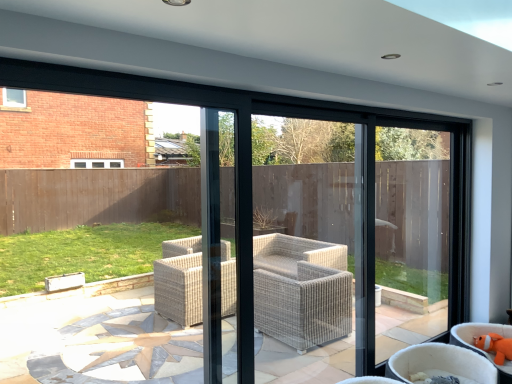
This screenshot has width=512, height=384. What are the coordinates of `beige wicker chair at lower right, which ranks as the second chair in right-to-left order` in the screenshot? It's located at (441, 363).

The image size is (512, 384). I want to click on orange plush toy at lower right, so click(495, 346).

Find the location of `beige wicker chair at lower right, which ranks as the second chair in right-to-left order`. beige wicker chair at lower right, which ranks as the second chair in right-to-left order is located at coordinates (441, 363).

Can you confirm if orange plush toy at lower right, positioned as the 1th chair in right-to-left order, is positioned to the left of beige wicker chair at lower right, which is counted as the 1th chair, starting from the left?

No.

From the image's perspective, is orange plush toy at lower right, positioned as the 1th chair in right-to-left order, under beige wicker chair at lower right, which is counted as the 1th chair, starting from the left?

Actually, orange plush toy at lower right, positioned as the 1th chair in right-to-left order, appears above beige wicker chair at lower right, which is counted as the 1th chair, starting from the left, in the image.

From a real-world perspective, which is physically above, orange plush toy at lower right, positioned as the 1th chair in right-to-left order, or beige wicker chair at lower right, which ranks as the second chair in right-to-left order?

orange plush toy at lower right, positioned as the 1th chair in right-to-left order, from a real-world perspective.

Find the location of a particular element. This screenshot has width=512, height=384. chair on the left of orange plush toy at lower right, positioned as the 1th chair in right-to-left order is located at coordinates (441, 363).

Are beige wicker chair at lower right, which is counted as the 1th chair, starting from the left, and orange plush toy at lower right making contact?

No.

Which of these two, beige wicker chair at lower right, which ranks as the second chair in right-to-left order, or orange plush toy at lower right, stands shorter?

orange plush toy at lower right.

Is beige wicker chair at lower right, which is counted as the 1th chair, starting from the left, spatially inside orange plush toy at lower right, or outside of it?

beige wicker chair at lower right, which is counted as the 1th chair, starting from the left, cannot be found inside orange plush toy at lower right.

Which point is more distant from viewer, (487, 361) or (479, 342)?

The point (479, 342) is behind.

Consider the image. Do you think orange plush toy at lower right, positioned as the 1th chair in right-to-left order, is within orange plush toy at lower right, or outside of it?

orange plush toy at lower right, positioned as the 1th chair in right-to-left order, cannot be found inside orange plush toy at lower right.

Are orange plush toy at lower right, positioned as the 1th chair in right-to-left order, and orange plush toy at lower right making contact?

Indeed, orange plush toy at lower right, positioned as the 1th chair in right-to-left order, and orange plush toy at lower right are beside each other and touching.

Between orange plush toy at lower right, which is the 2th chair from left to right, and orange plush toy at lower right, which one appears on the right side from the viewer's perspective?

orange plush toy at lower right is more to the right.

Which of these two, orange plush toy at lower right or orange plush toy at lower right, which is the 2th chair from left to right, is wider?

orange plush toy at lower right, which is the 2th chair from left to right.

Where is `toy behind the orange plush toy at lower right, which is the 2th chair from left to right`? toy behind the orange plush toy at lower right, which is the 2th chair from left to right is located at coordinates (495, 346).

Is orange plush toy at lower right at the left side of orange plush toy at lower right, positioned as the 1th chair in right-to-left order?

No, orange plush toy at lower right is not to the left of orange plush toy at lower right, positioned as the 1th chair in right-to-left order.

Considering the points (501, 353) and (501, 335), which point is behind, point (501, 353) or point (501, 335)?

Point (501, 335)

Does beige wicker chair at lower right, which ranks as the second chair in right-to-left order, lie in front of orange plush toy at lower right, positioned as the 1th chair in right-to-left order?

Yes, beige wicker chair at lower right, which ranks as the second chair in right-to-left order, is closer to the viewer.

Does beige wicker chair at lower right, which is counted as the 1th chair, starting from the left, have a larger size compared to orange plush toy at lower right, positioned as the 1th chair in right-to-left order?

Correct, beige wicker chair at lower right, which is counted as the 1th chair, starting from the left, is larger in size than orange plush toy at lower right, positioned as the 1th chair in right-to-left order.

Locate an element on the screen. The height and width of the screenshot is (384, 512). chair on the right of the beige wicker chair at lower right, which is counted as the 1th chair, starting from the left is located at coordinates (477, 335).

Does point (406, 354) appear closer or farther from the camera than point (469, 327)?

Clearly, point (406, 354) is closer to the camera than point (469, 327).

Which is behind, orange plush toy at lower right or beige wicker chair at lower right, which ranks as the second chair in right-to-left order?

orange plush toy at lower right is more distant.

The width and height of the screenshot is (512, 384). In order to click on toy above the beige wicker chair at lower right, which is counted as the 1th chair, starting from the left (from a real-world perspective) in this screenshot , I will do `click(495, 346)`.

From a real-world perspective, which is physically below, orange plush toy at lower right or beige wicker chair at lower right, which is counted as the 1th chair, starting from the left?

beige wicker chair at lower right, which is counted as the 1th chair, starting from the left, from a real-world perspective.

Who is bigger, orange plush toy at lower right or beige wicker chair at lower right, which ranks as the second chair in right-to-left order?

beige wicker chair at lower right, which ranks as the second chair in right-to-left order, is bigger.

At what (x,y) coordinates should I click in order to perform the action: click on chair behind the beige wicker chair at lower right, which is counted as the 1th chair, starting from the left. Please return your answer as a coordinate pair (x, y). The image size is (512, 384). Looking at the image, I should click on (477, 335).

You are a GUI agent. You are given a task and a screenshot of the screen. Output one action in this format:
    pyautogui.click(x=<x>, y=<y>)
    Task: Click on the toy above the beige wicker chair at lower right, which is counted as the 1th chair, starting from the left (from a real-world perspective)
    
    Given the screenshot: What is the action you would take?
    pyautogui.click(x=495, y=346)

Considering their positions, is beige wicker chair at lower right, which is counted as the 1th chair, starting from the left, positioned further to orange plush toy at lower right than orange plush toy at lower right, which is the 2th chair from left to right?

Based on the image, beige wicker chair at lower right, which is counted as the 1th chair, starting from the left, appears to be further to orange plush toy at lower right.

Considering their positions, is orange plush toy at lower right positioned closer to beige wicker chair at lower right, which ranks as the second chair in right-to-left order, than orange plush toy at lower right, which is the 2th chair from left to right?

orange plush toy at lower right, which is the 2th chair from left to right, lies closer to beige wicker chair at lower right, which ranks as the second chair in right-to-left order, than the other object.

From the image, which object appears to be nearer to orange plush toy at lower right, orange plush toy at lower right, positioned as the 1th chair in right-to-left order, or beige wicker chair at lower right, which ranks as the second chair in right-to-left order?

orange plush toy at lower right, positioned as the 1th chair in right-to-left order, is positioned closer to the anchor orange plush toy at lower right.

Considering their positions, is beige wicker chair at lower right, which ranks as the second chair in right-to-left order, positioned further to orange plush toy at lower right, which is the 2th chair from left to right, than orange plush toy at lower right?

Based on the image, beige wicker chair at lower right, which ranks as the second chair in right-to-left order, appears to be further to orange plush toy at lower right, which is the 2th chair from left to right.

Considering their positions, is orange plush toy at lower right positioned closer to orange plush toy at lower right, positioned as the 1th chair in right-to-left order, than beige wicker chair at lower right, which ranks as the second chair in right-to-left order?

Among the two, orange plush toy at lower right is located nearer to orange plush toy at lower right, positioned as the 1th chair in right-to-left order.

From the image, which object appears to be farther from beige wicker chair at lower right, which ranks as the second chair in right-to-left order, orange plush toy at lower right, positioned as the 1th chair in right-to-left order, or orange plush toy at lower right?

orange plush toy at lower right lies further to beige wicker chair at lower right, which ranks as the second chair in right-to-left order, than the other object.

In order to click on chair positioned between beige wicker chair at lower right, which is counted as the 1th chair, starting from the left, and orange plush toy at lower right from near to far in this screenshot , I will do `click(477, 335)`.